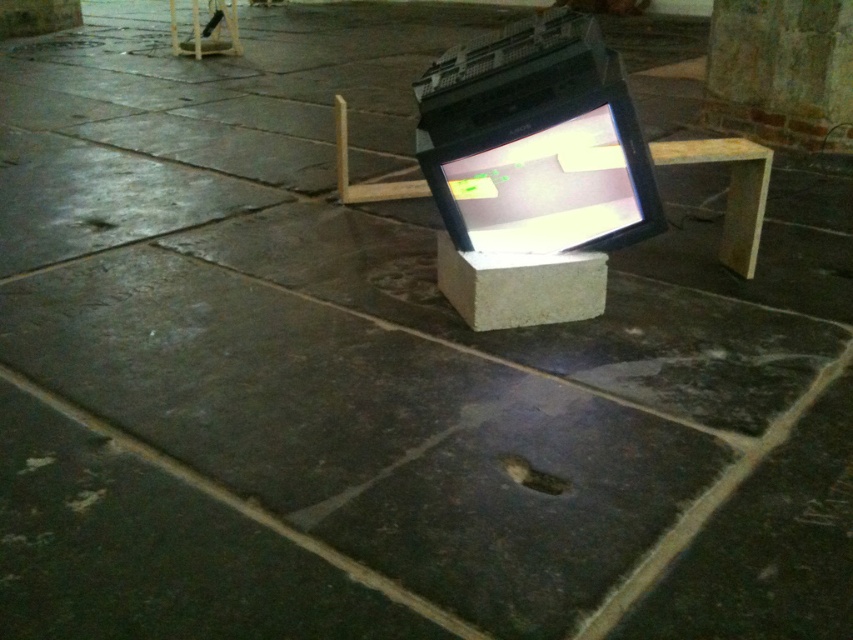
Question: Is matte black monitor at center above wooden at center?

Choices:
 (A) no
 (B) yes

Answer: (A)

Question: Which of the following is the closest to the observer?

Choices:
 (A) matte black monitor at center
 (B) wooden at center

Answer: (A)

Question: In this image, where is matte black monitor at center located relative to wooden at center?

Choices:
 (A) right
 (B) left

Answer: (B)

Question: Which point is farther from the camera taking this photo?

Choices:
 (A) (556, 250)
 (B) (726, 244)

Answer: (B)

Question: Is matte black monitor at center to the left of wooden at center from the viewer's perspective?

Choices:
 (A) yes
 (B) no

Answer: (A)